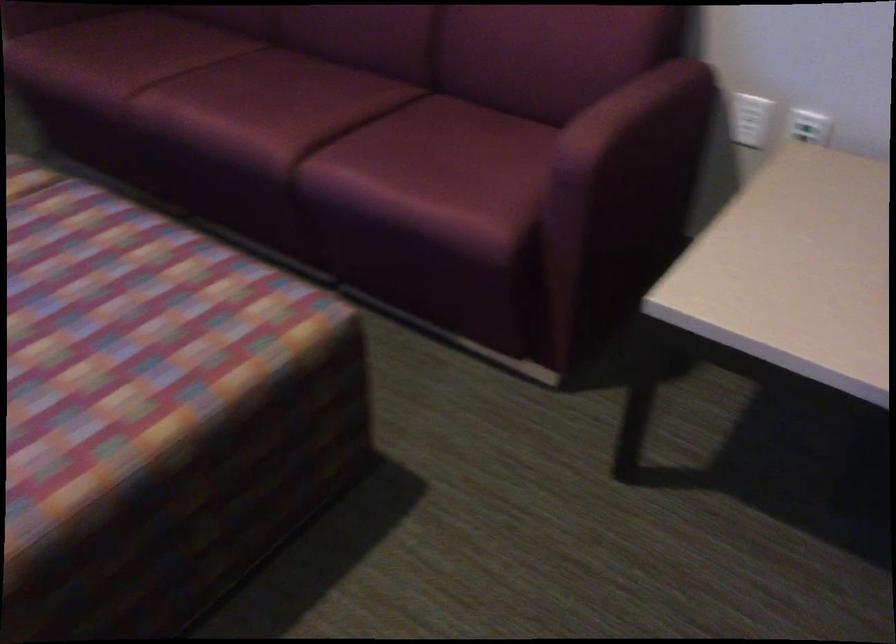
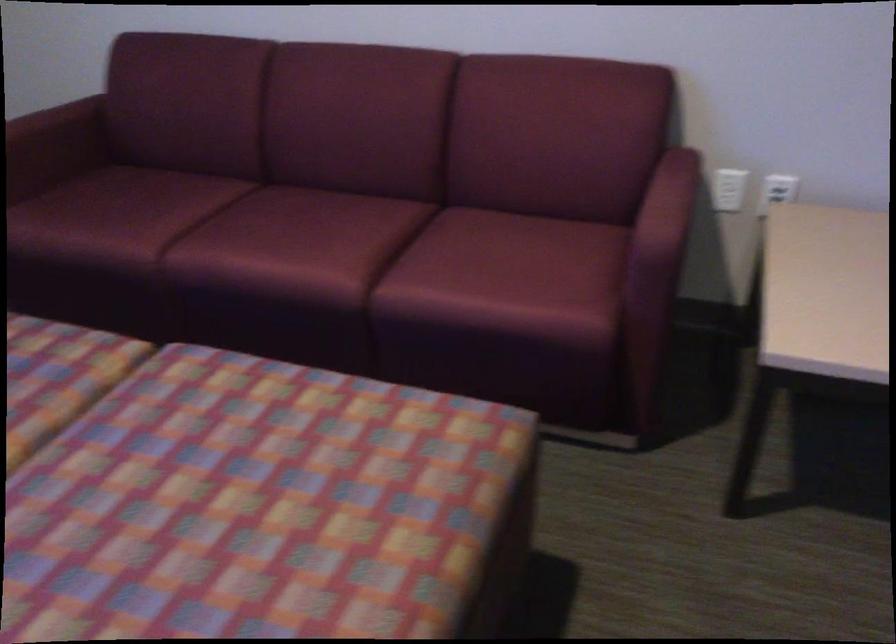
Find the pixel in the second image that matches the point at 748,122 in the first image.

(728, 189)